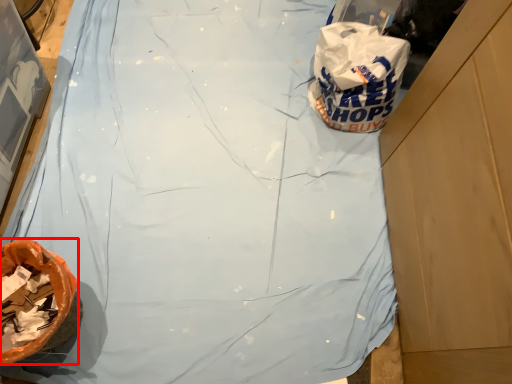
Question: From the image's perspective, where is waste (annotated by the red box) located in relation to plastic bag in the image?

Choices:
 (A) above
 (B) below

Answer: (B)